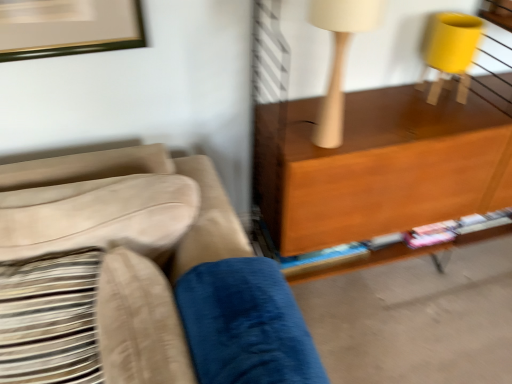
What are the coordinates of `white matte table lamp at upper right` in the screenshot? It's located at (338, 58).

What are the coordinates of `suede beige couch at left` in the screenshot? It's located at (138, 278).

Locate an element on the screen. velvety blue pillow at lower center, the 2th pillow positioned from the left is located at coordinates (245, 325).

Choose the correct answer: Is suede beige couch at left inside velvety blue pillow at lower center, the first pillow positioned from the right, or outside it?

suede beige couch at left cannot be found inside velvety blue pillow at lower center, the first pillow positioned from the right.

Is suede beige couch at left not close to velvety blue pillow at lower center, the 2th pillow positioned from the left?

No, suede beige couch at left is not far away from velvety blue pillow at lower center, the 2th pillow positioned from the left.

Can you confirm if suede beige couch at left is smaller than velvety blue pillow at lower center, the first pillow positioned from the right?

Actually, suede beige couch at left might be larger than velvety blue pillow at lower center, the first pillow positioned from the right.

In the image, is suede beige couch at left on the left side or the right side of velvety blue pillow at lower center, the 2th pillow positioned from the left?

Based on their positions, suede beige couch at left is located to the left of velvety blue pillow at lower center, the 2th pillow positioned from the left.

Does beige textured pillow at left, acting as the first pillow starting from the left, contain velvety blue pillow at lower center, the first pillow positioned from the right?

No.

What's the angular difference between beige textured pillow at left, acting as the first pillow starting from the left, and velvety blue pillow at lower center, the first pillow positioned from the right,'s facing directions?

They differ by 2.36 degrees in their facing directions.

Find the location of a particular element. pillow below the beige textured pillow at left, placed as the 2th pillow when sorted from right to left (from the image's perspective) is located at coordinates (245, 325).

In the image, there is a beige textured pillow at left, acting as the first pillow starting from the left. Identify the location of studio couch below it (from the image's perspective). Image resolution: width=512 pixels, height=384 pixels. (138, 278).

Which is correct: beige textured pillow at left, placed as the 2th pillow when sorted from right to left, is inside suede beige couch at left, or outside of it?

beige textured pillow at left, placed as the 2th pillow when sorted from right to left, is contained in suede beige couch at left.

Which point is more forward, (90,251) or (42,202)?

The point (42,202) is in front.

You are a GUI agent. You are given a task and a screenshot of the screen. Output one action in this format:
    pyautogui.click(x=<x>, y=<y>)
    Task: Click on the studio couch below the wooden shelf at right (from the image's perspective)
    This screenshot has height=384, width=512.
    Given the screenshot: What is the action you would take?
    tap(138, 278)

Is the position of wooden shelf at right less distant than that of suede beige couch at left?

No, wooden shelf at right is further to the viewer.

From the image's perspective, who appears lower, wooden shelf at right or suede beige couch at left?

suede beige couch at left.

How different are the orientations of wooden shelf at right and suede beige couch at left in degrees?

The angular difference between wooden shelf at right and suede beige couch at left is 0.394 degrees.

Which of these two, beige textured pillow at left, placed as the 2th pillow when sorted from right to left, or wooden shelf at right, is thinner?

Thinner between the two is wooden shelf at right.

Looking at this image, is beige textured pillow at left, acting as the first pillow starting from the left, shorter than wooden shelf at right?

Yes, beige textured pillow at left, acting as the first pillow starting from the left, is shorter than wooden shelf at right.

I want to click on shelf that is above the beige textured pillow at left, acting as the first pillow starting from the left (from the image's perspective), so click(378, 166).

Considering the positions of objects beige textured pillow at left, acting as the first pillow starting from the left, and wooden shelf at right in the image provided, who is more to the right, beige textured pillow at left, acting as the first pillow starting from the left, or wooden shelf at right?

Positioned to the right is wooden shelf at right.

Which of these two, wooden shelf at right or beige textured pillow at left, placed as the 2th pillow when sorted from right to left, is bigger?

Bigger between the two is wooden shelf at right.

Does wooden shelf at right have a greater height compared to beige textured pillow at left, acting as the first pillow starting from the left?

Correct, wooden shelf at right is much taller as beige textured pillow at left, acting as the first pillow starting from the left.

Are wooden shelf at right and beige textured pillow at left, placed as the 2th pillow when sorted from right to left, far apart?

No, wooden shelf at right is not far from beige textured pillow at left, placed as the 2th pillow when sorted from right to left.

Is wooden shelf at right facing towards beige textured pillow at left, placed as the 2th pillow when sorted from right to left?

No, wooden shelf at right is not aimed at beige textured pillow at left, placed as the 2th pillow when sorted from right to left.

Does suede beige couch at left appear on the left side of wooden shelf at right?

Indeed, suede beige couch at left is positioned on the left side of wooden shelf at right.

Locate an element on the screen. The height and width of the screenshot is (384, 512). studio couch that appears on the left of wooden shelf at right is located at coordinates (138, 278).

Between point (56, 299) and point (293, 240), which one is positioned behind?

The point (293, 240) is farther.

From a real-world perspective, is suede beige couch at left below wooden shelf at right?

Yes.

This screenshot has width=512, height=384. Identify the location of studio couch on the left of velvety blue pillow at lower center, the 2th pillow positioned from the left. (138, 278).

Locate an element on the screen. This screenshot has width=512, height=384. pillow above the velvety blue pillow at lower center, the first pillow positioned from the right (from a real-world perspective) is located at coordinates (50, 319).

Estimate the real-world distances between objects in this image. Which object is further from wooden shelf at right, beige textured pillow at left, acting as the first pillow starting from the left, or suede beige couch at left?

beige textured pillow at left, acting as the first pillow starting from the left, is positioned further to the anchor wooden shelf at right.

Which object lies further to the anchor point suede beige couch at left, wooden shelf at right or white matte table lamp at upper right?

white matte table lamp at upper right is further to suede beige couch at left.

When comparing their distances from suede beige couch at left, does velvety blue pillow at lower center, the 2th pillow positioned from the left, or white matte table lamp at upper right seem further?

The object further to suede beige couch at left is white matte table lamp at upper right.

When comparing their distances from white matte table lamp at upper right, does wooden shelf at right or beige textured pillow at left, acting as the first pillow starting from the left, seem closer?

Based on the image, wooden shelf at right appears to be nearer to white matte table lamp at upper right.

Which object lies nearer to the anchor point velvety blue pillow at lower center, the first pillow positioned from the right, beige textured pillow at left, acting as the first pillow starting from the left, or white matte table lamp at upper right?

The object closer to velvety blue pillow at lower center, the first pillow positioned from the right, is beige textured pillow at left, acting as the first pillow starting from the left.

Based on their spatial positions, is wooden shelf at right or beige textured pillow at left, placed as the 2th pillow when sorted from right to left, closer to suede beige couch at left?

Among the two, beige textured pillow at left, placed as the 2th pillow when sorted from right to left, is located nearer to suede beige couch at left.

Which object lies further to the anchor point white matte table lamp at upper right, suede beige couch at left or velvety blue pillow at lower center, the 2th pillow positioned from the left?

suede beige couch at left is further to white matte table lamp at upper right.

Based on their spatial positions, is beige textured pillow at left, placed as the 2th pillow when sorted from right to left, or white matte table lamp at upper right closer to suede beige couch at left?

The object closer to suede beige couch at left is beige textured pillow at left, placed as the 2th pillow when sorted from right to left.

This screenshot has height=384, width=512. I want to click on pillow between white matte table lamp at upper right and velvety blue pillow at lower center, the 2th pillow positioned from the left, in the up-down direction, so click(x=50, y=319).

At what (x,y) coordinates should I click in order to perform the action: click on table lamp between suede beige couch at left and wooden shelf at right from left to right. Please return your answer as a coordinate pair (x, y). The image size is (512, 384). Looking at the image, I should click on (338, 58).

Find the location of a particular element. The width and height of the screenshot is (512, 384). pillow between suede beige couch at left and wooden shelf at right from left to right is located at coordinates (245, 325).

Find the location of a particular element. pillow between beige textured pillow at left, acting as the first pillow starting from the left, and wooden shelf at right is located at coordinates (245, 325).